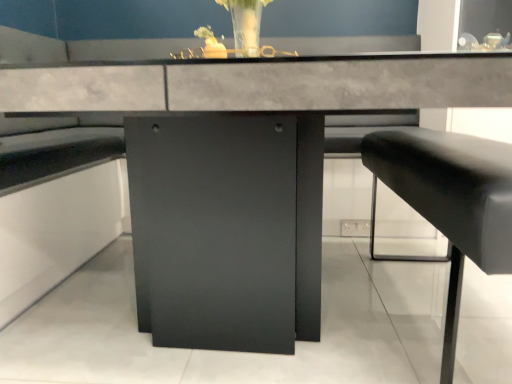
Question: Does black leather cushion at right come behind translucent glass vase at upper center?

Choices:
 (A) no
 (B) yes

Answer: (A)

Question: Is black leather cushion at right looking in the opposite direction of translucent glass vase at upper center?

Choices:
 (A) no
 (B) yes

Answer: (A)

Question: Does black leather cushion at right have a greater width compared to translucent glass vase at upper center?

Choices:
 (A) yes
 (B) no

Answer: (A)

Question: Is black leather cushion at right taller than translucent glass vase at upper center?

Choices:
 (A) yes
 (B) no

Answer: (A)

Question: Can you confirm if black leather cushion at right is smaller than translucent glass vase at upper center?

Choices:
 (A) no
 (B) yes

Answer: (A)

Question: Is black leather cushion at right outside of translucent glass vase at upper center?

Choices:
 (A) no
 (B) yes

Answer: (B)

Question: Considering the relative sizes of translucent glass vase at upper center and black leather cushion at right in the image provided, is translucent glass vase at upper center shorter than black leather cushion at right?

Choices:
 (A) yes
 (B) no

Answer: (A)

Question: Does translucent glass vase at upper center have a smaller size compared to black leather cushion at right?

Choices:
 (A) no
 (B) yes

Answer: (B)

Question: Considering the relative sizes of translucent glass vase at upper center and black leather cushion at right in the image provided, is translucent glass vase at upper center bigger than black leather cushion at right?

Choices:
 (A) yes
 (B) no

Answer: (B)

Question: Is translucent glass vase at upper center at the left side of black leather cushion at right?

Choices:
 (A) yes
 (B) no

Answer: (A)

Question: From the image's perspective, would you say translucent glass vase at upper center is shown under black leather cushion at right?

Choices:
 (A) yes
 (B) no

Answer: (B)

Question: Is translucent glass vase at upper center at the right side of black leather cushion at right?

Choices:
 (A) yes
 (B) no

Answer: (B)

Question: Choose the correct answer: Is translucent glass vase at upper center inside black leather cushion at right or outside it?

Choices:
 (A) inside
 (B) outside

Answer: (B)